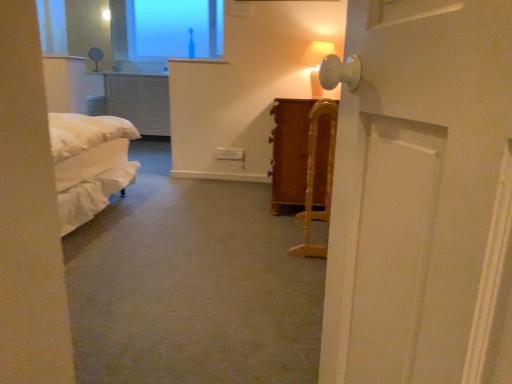
Question: Which direction should I rotate to face matte white table lamp at upper center, placed as the second table lamp when sorted from bottom to top, — up or down?

Choices:
 (A) up
 (B) down

Answer: (A)

Question: Is matte white table lamp at upper right, which is the second table lamp in back-to-front order, to the left of wooden cane at center from the viewer's perspective?

Choices:
 (A) no
 (B) yes

Answer: (A)

Question: Is matte white table lamp at upper right, the first table lamp in the right-to-left sequence, oriented towards wooden cane at center?

Choices:
 (A) yes
 (B) no

Answer: (B)

Question: Would you say matte white table lamp at upper right, which appears as the 2th table lamp when viewed from the top, is outside wooden cane at center?

Choices:
 (A) no
 (B) yes

Answer: (B)

Question: Is matte white table lamp at upper right, positioned as the 1th table lamp in bottom-to-top order, bigger than wooden cane at center?

Choices:
 (A) no
 (B) yes

Answer: (A)

Question: Considering the relative sizes of matte white table lamp at upper right, positioned as the 1th table lamp in bottom-to-top order, and wooden cane at center in the image provided, is matte white table lamp at upper right, positioned as the 1th table lamp in bottom-to-top order, wider than wooden cane at center?

Choices:
 (A) no
 (B) yes

Answer: (B)

Question: Can you see matte white table lamp at upper right, positioned as the 1th table lamp in bottom-to-top order, touching wooden cane at center?

Choices:
 (A) no
 (B) yes

Answer: (A)

Question: Is wooden cane at center taller than matte white table lamp at upper right, the first table lamp in the right-to-left sequence?

Choices:
 (A) yes
 (B) no

Answer: (A)

Question: Can you confirm if wooden cane at center is positioned to the right of matte white table lamp at upper right, which appears as the 2th table lamp when viewed from the top?

Choices:
 (A) yes
 (B) no

Answer: (B)

Question: Is wooden cane at center far from matte white table lamp at upper right, placed as the first table lamp when sorted from front to back?

Choices:
 (A) no
 (B) yes

Answer: (A)

Question: Is wooden cane at center facing towards matte white table lamp at upper right, which appears as the 2th table lamp when viewed from the top?

Choices:
 (A) yes
 (B) no

Answer: (B)

Question: Does wooden cane at center come behind matte white table lamp at upper right, which appears as the 2th table lamp when viewed from the top?

Choices:
 (A) no
 (B) yes

Answer: (A)

Question: Considering the relative positions of wooden cane at center and matte white table lamp at upper right, placed as the second table lamp when sorted from left to right, in the image provided, is wooden cane at center to the left of matte white table lamp at upper right, placed as the second table lamp when sorted from left to right, from the viewer's perspective?

Choices:
 (A) yes
 (B) no

Answer: (A)

Question: From a real-world perspective, is matte white table lamp at upper center, which ranks as the 1th table lamp in back-to-front order, physically below matte white table lamp at upper right, the first table lamp in the right-to-left sequence?

Choices:
 (A) yes
 (B) no

Answer: (B)